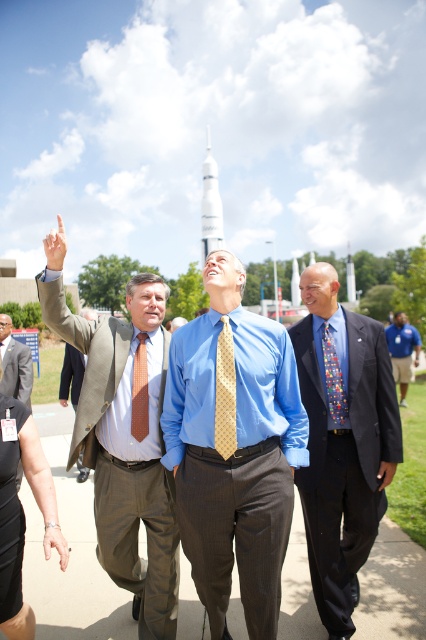
You are a photographer positioned 20 meters away from the group. You want to take a photo that includes both the blue pinstripe shirt at center and the blue shirt at center. Given the distance between them, will they both fit in your camera frame if the maximum horizontal field of view is 10 meters?

The blue pinstripe shirt at center and blue shirt at center are 13.68 meters apart, which exceeds the camera frame of 10 meters. Therefore, they will not both fit in the photo.

You are standing at the entrance of the facility and see the white glossy rocket at center. If you walk straight towards it, will you reach it before the path curves to the right?

The white glossy rocket at center is located at point (210, 205), so if you walk straight towards it, you will reach it before the path curves to the right because its coordinates indicate it is positioned directly ahead in your path.